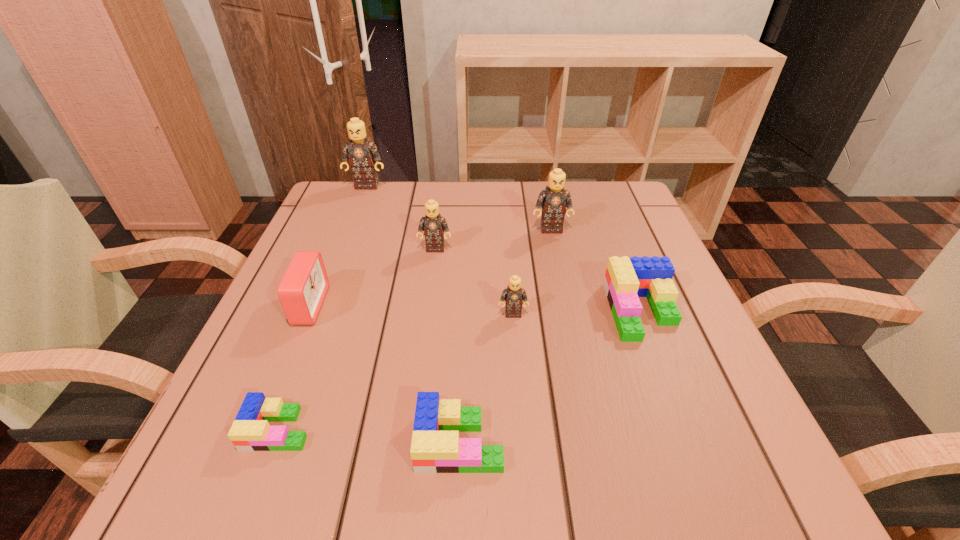
In the image, there is a desktop. Identify the location of vacant space at the right edge. This screenshot has width=960, height=540. (678, 383).

You are a GUI agent. You are given a task and a screenshot of the screen. Output one action in this format:
    pyautogui.click(x=<x>, y=<y>)
    Task: Click on the vacant position at the far left corner of the desktop
    This screenshot has height=540, width=960.
    Given the screenshot: What is the action you would take?
    pyautogui.click(x=343, y=221)

Image resolution: width=960 pixels, height=540 pixels. I want to click on vacant region at the near left corner of the desktop, so click(214, 480).

In order to click on free location at the far right corner in this screenshot , I will do `click(611, 186)`.

You are a GUI agent. You are given a task and a screenshot of the screen. Output one action in this format:
    pyautogui.click(x=<x>, y=<y>)
    Task: Click on the vacant area that lies between the third tan Lego from right to left and the seventh object from left to right
    The height and width of the screenshot is (540, 960).
    Given the screenshot: What is the action you would take?
    pyautogui.click(x=493, y=239)

Where is `vacant area between the seventh nearest object and the tallest object`? The image size is (960, 540). vacant area between the seventh nearest object and the tallest object is located at coordinates (459, 207).

Identify the location of free point between the third shortest Lego and the fourth tallest Lego. (577, 313).

The height and width of the screenshot is (540, 960). Find the location of `vacant space in between the alarm clock and the second green Lego from right to left`. vacant space in between the alarm clock and the second green Lego from right to left is located at coordinates (384, 374).

Image resolution: width=960 pixels, height=540 pixels. Find the location of `free spot between the farthest green Lego and the biggest tan Lego`. free spot between the farthest green Lego and the biggest tan Lego is located at coordinates (504, 248).

Locate an element on the screen. empty space between the second farthest tan Lego and the second biggest green Lego is located at coordinates (506, 335).